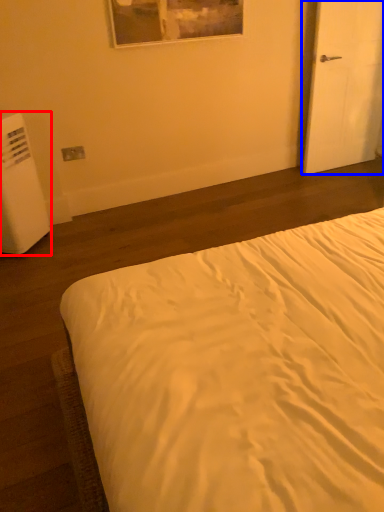
Question: Which of the following is the closest to the observer, water heater (highlighted by a red box) or door (highlighted by a blue box)?

Choices:
 (A) water heater
 (B) door

Answer: (A)